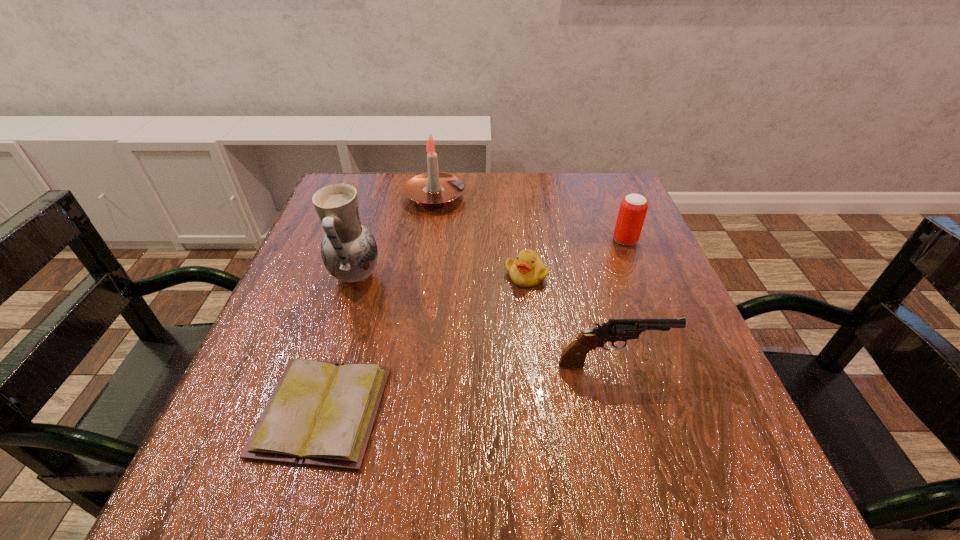
This screenshot has height=540, width=960. What are the coordinates of `vacant space at the far edge of the desktop` in the screenshot? It's located at (514, 218).

At what (x,y) coordinates should I click in order to perform the action: click on vacant space at the near edge of the desktop. Please return your answer as a coordinate pair (x, y). Looking at the image, I should click on point(449,476).

Locate an element on the screen. The image size is (960, 540). vacant space at the left edge is located at coordinates pyautogui.click(x=313, y=256).

Where is `free point at the right edge`? free point at the right edge is located at coordinates (629, 404).

You are a GUI agent. You are given a task and a screenshot of the screen. Output one action in this format:
    pyautogui.click(x=<x>, y=<y>)
    Task: Click on the vacant position at the far left corner of the desktop
    
    Given the screenshot: What is the action you would take?
    pos(378,192)

Locate an element on the screen. The height and width of the screenshot is (540, 960). vacant space at the far right corner is located at coordinates [x=613, y=172].

The width and height of the screenshot is (960, 540). What are the coordinates of `vacant region at the near right corner of the desktop` in the screenshot? It's located at (671, 508).

You are a GUI agent. You are given a task and a screenshot of the screen. Output one action in this format:
    pyautogui.click(x=<x>, y=<y>)
    Task: Click on the free space that is in between the fifth tallest object and the second farthest object
    
    Given the screenshot: What is the action you would take?
    pyautogui.click(x=576, y=258)

At what (x,y) coordinates should I click in order to perform the action: click on empty location between the diary and the farthest object. Please return your answer as a coordinate pair (x, y). The image size is (960, 540). Looking at the image, I should click on (379, 304).

This screenshot has height=540, width=960. I want to click on free space between the pottery and the gun, so click(x=484, y=320).